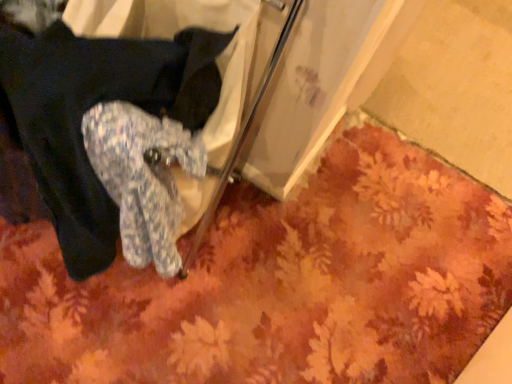
Question: Could you tell me if fluffy blue socks at lower left is turned towards floral carpet at lower center?

Choices:
 (A) yes
 (B) no

Answer: (B)

Question: Is fluffy blue socks at lower left shorter than floral carpet at lower center?

Choices:
 (A) yes
 (B) no

Answer: (B)

Question: Considering the relative sizes of fluffy blue socks at lower left and floral carpet at lower center in the image provided, is fluffy blue socks at lower left thinner than floral carpet at lower center?

Choices:
 (A) no
 (B) yes

Answer: (B)

Question: Is floral carpet at lower center a part of fluffy blue socks at lower left?

Choices:
 (A) no
 (B) yes

Answer: (A)

Question: Is fluffy blue socks at lower left bigger than floral carpet at lower center?

Choices:
 (A) yes
 (B) no

Answer: (A)

Question: Is fluffy blue socks at lower left taller than floral carpet at lower center?

Choices:
 (A) yes
 (B) no

Answer: (A)

Question: From a real-world perspective, is floral carpet at lower center physically below fluffy blue socks at lower left?

Choices:
 (A) yes
 (B) no

Answer: (A)

Question: From the image's perspective, would you say floral carpet at lower center is shown under fluffy blue socks at lower left?

Choices:
 (A) yes
 (B) no

Answer: (A)

Question: Is floral carpet at lower center beside fluffy blue socks at lower left?

Choices:
 (A) yes
 (B) no

Answer: (B)

Question: Does floral carpet at lower center appear on the left side of fluffy blue socks at lower left?

Choices:
 (A) yes
 (B) no

Answer: (B)

Question: Is floral carpet at lower center further to the viewer compared to fluffy blue socks at lower left?

Choices:
 (A) no
 (B) yes

Answer: (B)

Question: Can fluffy blue socks at lower left be found inside floral carpet at lower center?

Choices:
 (A) yes
 (B) no

Answer: (B)

Question: In terms of height, does floral carpet at lower center look taller or shorter compared to fluffy blue socks at lower left?

Choices:
 (A) short
 (B) tall

Answer: (A)